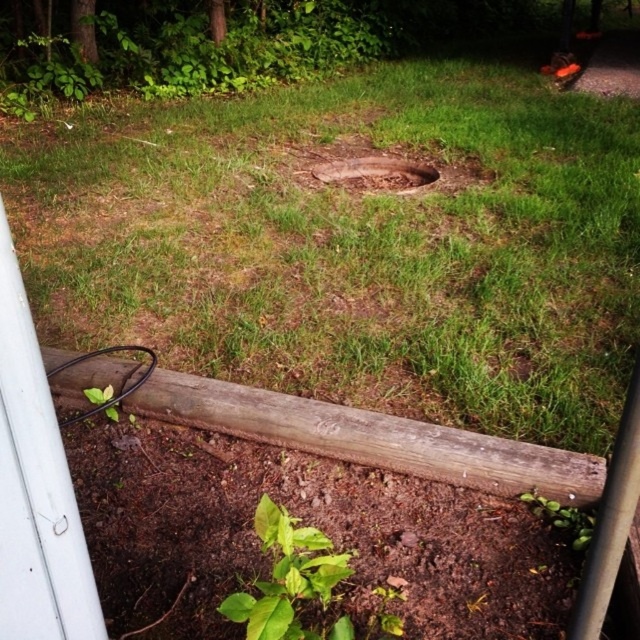
You are a gardener trying to locate the brown dirt hole at center and the green leafy weed at lower center in the grassy area. Which object is located to the left of the other?

The brown dirt hole at center is positioned on the left side of green leafy weed at lower center.

You are standing at the wooden plank in the foreground and want to reach the manhole cover in the midground. There are two points marked as point 1 at coordinates point (380, 166) and point 2 at coordinates point (556, 504). Which point is closer to you as you move towards the manhole cover?

Point (380, 166) is closer to you because it is further to the camera than point (556, 504), meaning it is physically nearer to your current position at the wooden plank.